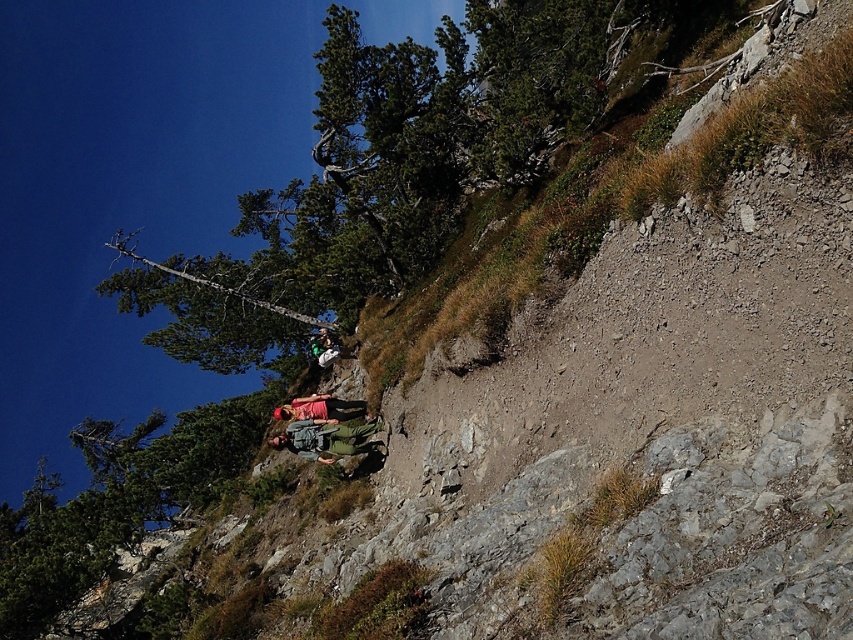
Question: Can you confirm if green canvas backpack at center is positioned above matte pink shirt at center?

Choices:
 (A) no
 (B) yes

Answer: (B)

Question: Among these points, which one is nearest to the camera?

Choices:
 (A) (x=364, y=429)
 (B) (x=328, y=401)
 (C) (x=339, y=355)

Answer: (A)

Question: Is the position of green canvas backpack at center more distant than that of matte pink shirt at center?

Choices:
 (A) yes
 (B) no

Answer: (B)

Question: Which of the following is the farthest from the observer?

Choices:
 (A) (378, 419)
 (B) (309, 349)
 (C) (335, 417)

Answer: (B)

Question: Among these objects, which one is farthest from the camera?

Choices:
 (A) green canvas backpack at center
 (B) green fabric backpack at center
 (C) matte pink shirt at center

Answer: (B)

Question: Can you confirm if green canvas backpack at center is thinner than green fabric backpack at center?

Choices:
 (A) yes
 (B) no

Answer: (A)